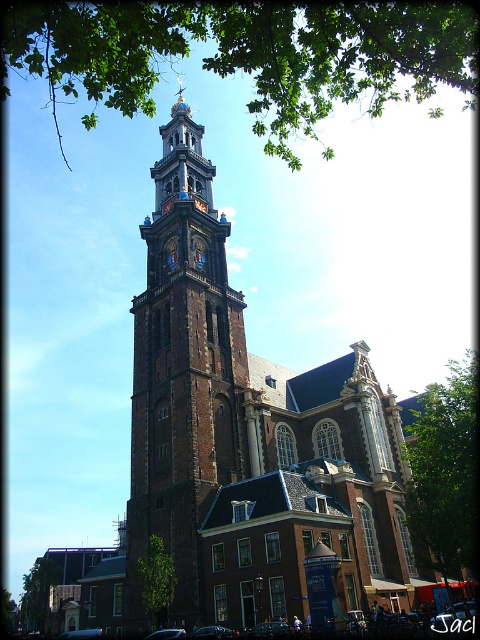
Question: Can you confirm if brown stone tower at center is smaller than green leafy tree at lower left?

Choices:
 (A) no
 (B) yes

Answer: (A)

Question: Which point is closer to the camera?

Choices:
 (A) (436, 426)
 (B) (284, 579)
 (C) (36, 557)

Answer: (B)

Question: Which point appears closest to the camera in this image?

Choices:
 (A) (430, 438)
 (B) (155, 17)
 (C) (37, 573)
 (D) (144, 592)

Answer: (B)

Question: Can you confirm if green leafy tree at center is positioned to the left of green leafy tree at lower left?

Choices:
 (A) no
 (B) yes

Answer: (A)

Question: From the image, what is the correct spatial relationship of brown stone tower at center in relation to green leafy tree at lower left?

Choices:
 (A) below
 (B) above

Answer: (B)

Question: Which object is closer to the camera taking this photo?

Choices:
 (A) green leafy tree at lower left
 (B) green leafy tree at right
 (C) green leafy tree at center

Answer: (C)